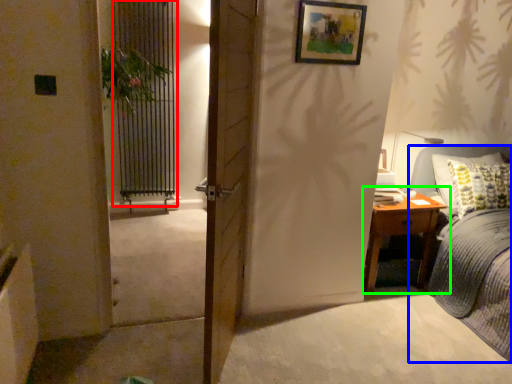
Question: Which object is positioned farthest from screen door (highlighted by a red box)? Select from bed (highlighted by a blue box) and nightstand (highlighted by a green box).

Choices:
 (A) bed
 (B) nightstand

Answer: (A)